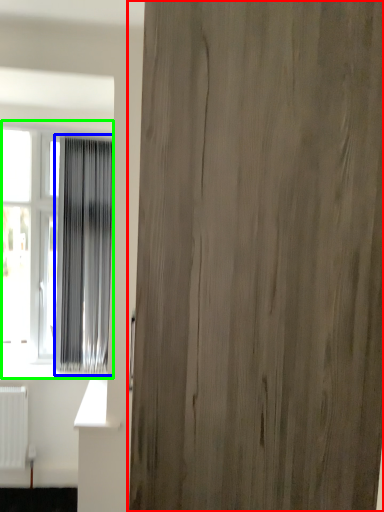
Question: Which object is the closest to the door (highlighted by a red box)? Choose among these: curtain (highlighted by a blue box) or window (highlighted by a green box).

Choices:
 (A) curtain
 (B) window

Answer: (A)